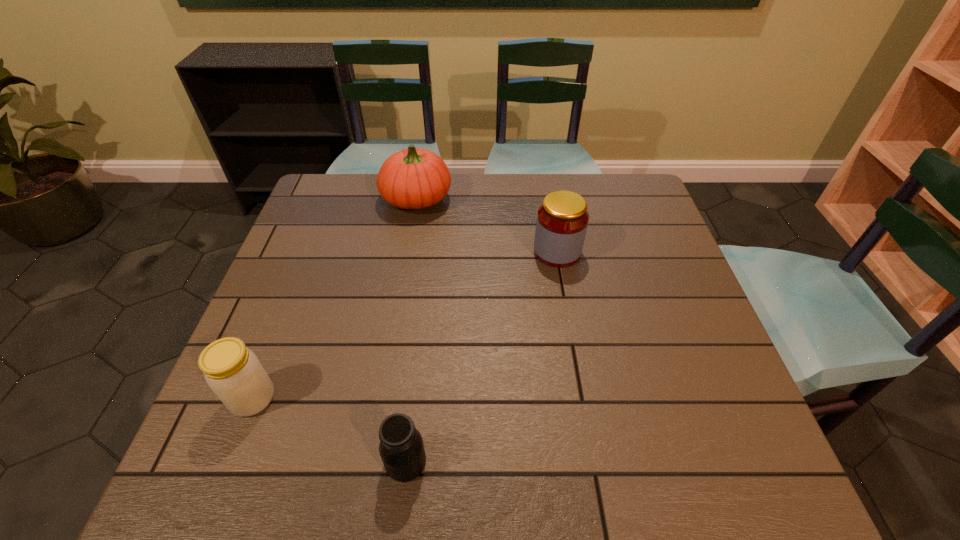
The width and height of the screenshot is (960, 540). I want to click on pumpkin, so click(413, 178).

Find the location of `the second farthest object`. the second farthest object is located at coordinates (562, 220).

Find the location of `the farthest jar`. the farthest jar is located at coordinates (562, 220).

What are the coordinates of `the second farthest jar` in the screenshot? It's located at (234, 373).

Image resolution: width=960 pixels, height=540 pixels. I want to click on the leftmost jar, so click(x=234, y=373).

Where is `the nearest jar`? This screenshot has width=960, height=540. the nearest jar is located at coordinates (401, 448).

Locate an element on the screen. The width and height of the screenshot is (960, 540). the shortest jar is located at coordinates (401, 448).

Identify the location of vacant space located on the left of the pumpkin. This screenshot has width=960, height=540. (336, 199).

At what (x,y) coordinates should I click in order to perform the action: click on free space located 0.060m on the front of the second farthest object. Please return your answer as a coordinate pair (x, y). Image resolution: width=960 pixels, height=540 pixels. Looking at the image, I should click on (563, 285).

This screenshot has width=960, height=540. I want to click on free space located 0.210m on the right of the leftmost object, so click(377, 399).